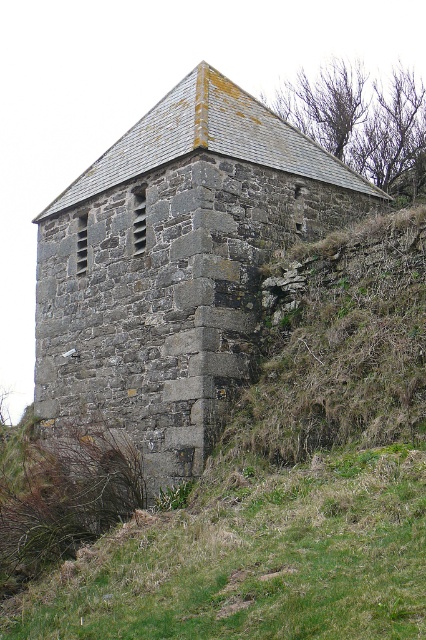
Question: Does gray stone tower at center have a smaller size compared to green grassy at lower center?

Choices:
 (A) no
 (B) yes

Answer: (A)

Question: Does gray stone tower at center have a smaller size compared to green grassy at lower center?

Choices:
 (A) no
 (B) yes

Answer: (A)

Question: Does gray stone tower at center appear on the left side of green grassy at lower center?

Choices:
 (A) yes
 (B) no

Answer: (A)

Question: Which object is farther from the camera taking this photo?

Choices:
 (A) green grassy at lower center
 (B) gray stone tower at center

Answer: (B)